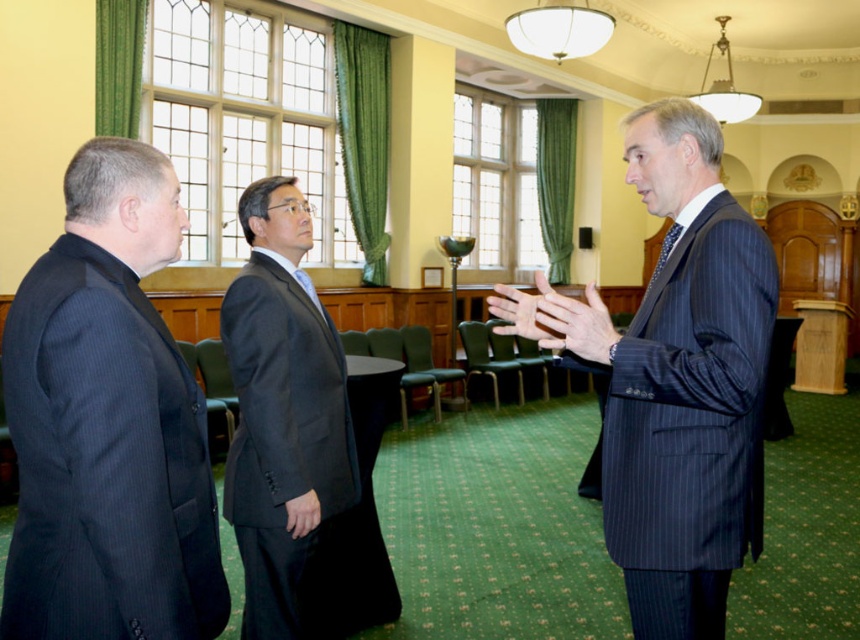
Question: Does pinstriped suit at center appear under dark gray suit at center?

Choices:
 (A) yes
 (B) no

Answer: (B)

Question: Is pinstriped suit at center below dark gray suit at center?

Choices:
 (A) no
 (B) yes

Answer: (A)

Question: Which of the following is the farthest from the observer?

Choices:
 (A) (29, 552)
 (B) (702, 566)
 (C) (280, 484)

Answer: (C)

Question: Which object is farther from the camera taking this photo?

Choices:
 (A) dark gray suit at center
 (B) dark pinstripe suit at left
 (C) pinstriped suit at center

Answer: (A)

Question: Which is nearer to the dark pinstripe suit at left?

Choices:
 (A) pinstriped suit at center
 (B) dark gray suit at center

Answer: (B)

Question: Does dark pinstripe suit at left appear under dark gray suit at center?

Choices:
 (A) no
 (B) yes

Answer: (A)